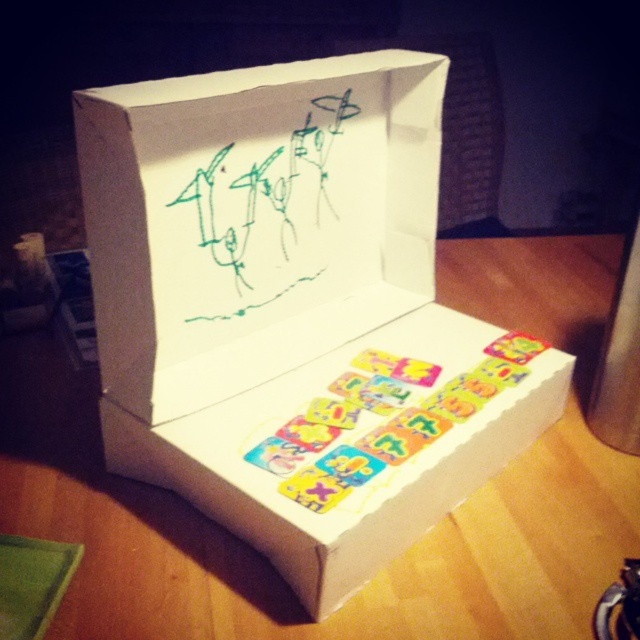
Question: Which object is farther from the camera taking this photo?

Choices:
 (A) white cardboard box at center
 (B) green marker drawing at center

Answer: (B)

Question: Which of the following is the closest to the observer?

Choices:
 (A) white cardboard box at center
 (B) green marker drawing at center

Answer: (A)

Question: Is white cardboard box at center to the left of green marker drawing at center from the viewer's perspective?

Choices:
 (A) yes
 (B) no

Answer: (B)

Question: Is white cardboard box at center closer to camera compared to green marker drawing at center?

Choices:
 (A) yes
 (B) no

Answer: (A)

Question: Can you confirm if white cardboard box at center is positioned to the right of green marker drawing at center?

Choices:
 (A) yes
 (B) no

Answer: (A)